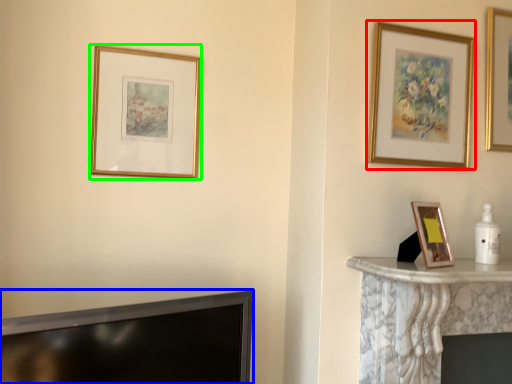
Question: Which is nearer to the picture frame (highlighted by a red box)? television (highlighted by a blue box) or picture frame (highlighted by a green box).

Choices:
 (A) television
 (B) picture frame

Answer: (B)